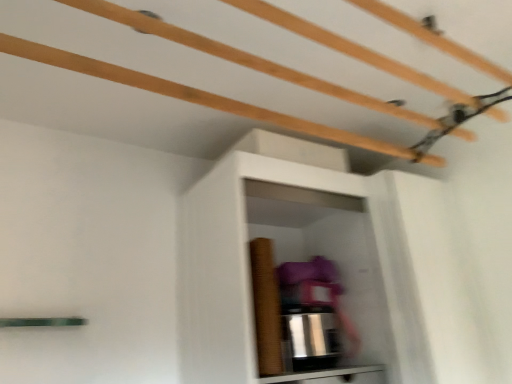
Question: Relative to white matte shelf at center, is matte brown cabinet at lower center in front or behind?

Choices:
 (A) front
 (B) behind

Answer: (B)

Question: Based on their positions, is matte brown cabinet at lower center located to the left or right of white matte shelf at center?

Choices:
 (A) left
 (B) right

Answer: (B)

Question: Is matte brown cabinet at lower center spatially inside white matte shelf at center, or outside of it?

Choices:
 (A) outside
 (B) inside

Answer: (A)

Question: Considering the positions of point (36, 64) and point (342, 374), is point (36, 64) closer or farther from the camera than point (342, 374)?

Choices:
 (A) closer
 (B) farther

Answer: (A)

Question: Is white matte shelf at center bigger or smaller than matte brown cabinet at lower center?

Choices:
 (A) big
 (B) small

Answer: (A)

Question: Is white matte shelf at center wider or thinner than matte brown cabinet at lower center?

Choices:
 (A) wide
 (B) thin

Answer: (A)

Question: Is white matte shelf at center in front of or behind matte brown cabinet at lower center in the image?

Choices:
 (A) front
 (B) behind

Answer: (A)